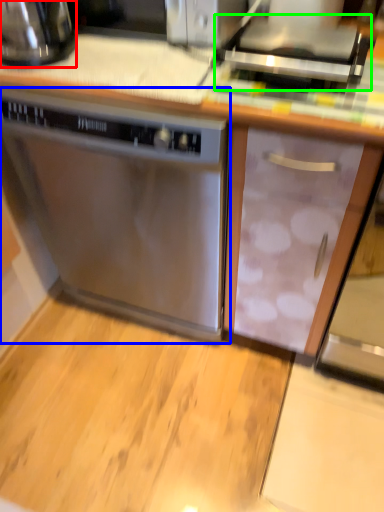
Question: Estimate the real-world distances between objects in this image. Which object is closer to kitchen appliance (highlighted by a red box), home appliance (highlighted by a blue box) or appliance (highlighted by a green box)?

Choices:
 (A) home appliance
 (B) appliance

Answer: (A)